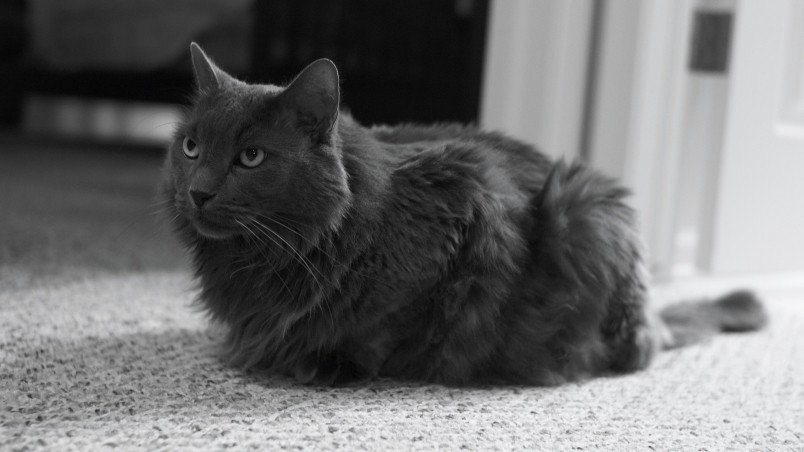
Identify the location of door. (740, 172).